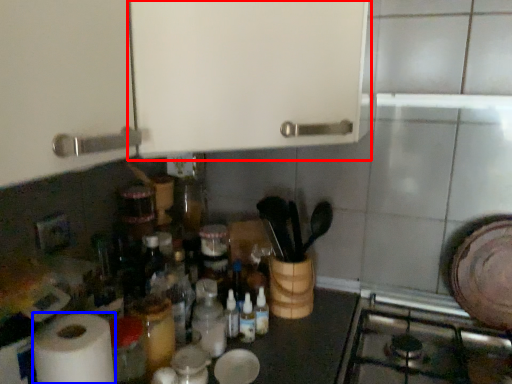
Question: Among these objects, which one is farthest to the camera, cabinetry (highlighted by a red box) or paper towel (highlighted by a blue box)?

Choices:
 (A) cabinetry
 (B) paper towel

Answer: (B)